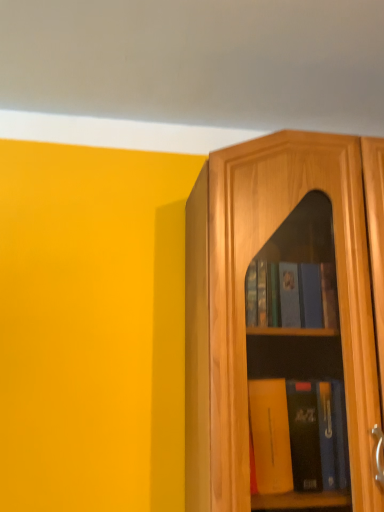
Find the location of a particular element. wooden cabinet at right is located at coordinates (281, 328).

What do you see at coordinates (281, 328) in the screenshot? Image resolution: width=384 pixels, height=512 pixels. I see `wooden cabinet at right` at bounding box center [281, 328].

What is the approximate width of wooden cabinet at right?

wooden cabinet at right is 20.04 inches wide.

In order to face wooden cabinet at right, should I rotate leftwards or rightwards?

You should rotate right by 18.429 degrees.

Find the location of a particular element. wooden cabinet at right is located at coordinates click(x=281, y=328).